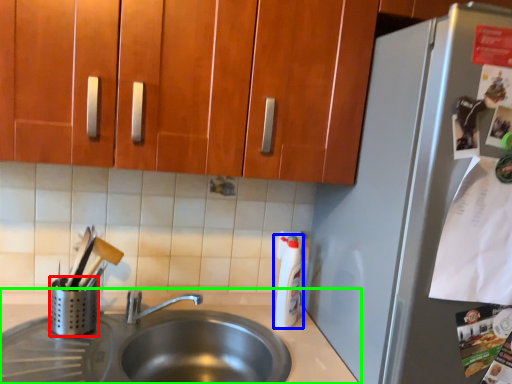
Question: Considering the real-world distances, which object is farthest from appliance (highlighted by a red box)? bottle (highlighted by a blue box) or countertop (highlighted by a green box)?

Choices:
 (A) bottle
 (B) countertop

Answer: (A)